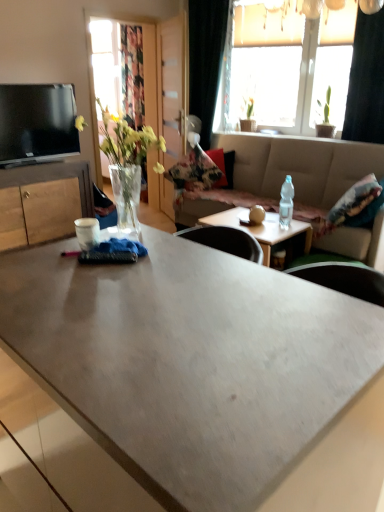
Question: Is black velvet curtain at upper right, the 1th curtain in the left-to-right sequence, at the left side of matte concrete coffee table at center, acting as the 1th coffee table starting from the front?

Choices:
 (A) yes
 (B) no

Answer: (B)

Question: Can you confirm if black velvet curtain at upper right, placed as the 1th curtain when sorted from back to front, is positioned to the right of matte concrete coffee table at center, acting as the 1th coffee table starting from the front?

Choices:
 (A) yes
 (B) no

Answer: (A)

Question: From a real-world perspective, is black velvet curtain at upper right, which is the 2th curtain in front-to-back order, below matte concrete coffee table at center, acting as the 1th coffee table starting from the front?

Choices:
 (A) yes
 (B) no

Answer: (B)

Question: Can matte concrete coffee table at center, acting as the 1th coffee table starting from the front, be found inside black velvet curtain at upper right, the 1th curtain in the left-to-right sequence?

Choices:
 (A) no
 (B) yes

Answer: (A)

Question: Does black velvet curtain at upper right, the 1th curtain in the left-to-right sequence, have a smaller size compared to matte concrete coffee table at center, which is counted as the second coffee table, starting from the back?

Choices:
 (A) yes
 (B) no

Answer: (A)

Question: From a real-world perspective, is black velvet curtain at upper right, the 1th curtain in the left-to-right sequence, over matte concrete coffee table at center, acting as the 1th coffee table starting from the front?

Choices:
 (A) yes
 (B) no

Answer: (A)

Question: Considering the relative sizes of wooden cabinet at left and clear glass vase at left in the image provided, is wooden cabinet at left shorter than clear glass vase at left?

Choices:
 (A) no
 (B) yes

Answer: (A)

Question: Could you tell me if wooden cabinet at left is turned towards clear glass vase at left?

Choices:
 (A) no
 (B) yes

Answer: (B)

Question: Is clear glass vase at left surrounded by wooden cabinet at left?

Choices:
 (A) no
 (B) yes

Answer: (A)

Question: Can you confirm if wooden cabinet at left is positioned to the right of clear glass vase at left?

Choices:
 (A) yes
 (B) no

Answer: (B)

Question: Is wooden cabinet at left at the left side of clear glass vase at left?

Choices:
 (A) no
 (B) yes

Answer: (B)

Question: Is wooden cabinet at left outside of clear glass vase at left?

Choices:
 (A) no
 (B) yes

Answer: (B)

Question: Is there a large distance between clear glass vase at left and wooden cabinet at left?

Choices:
 (A) yes
 (B) no

Answer: (A)